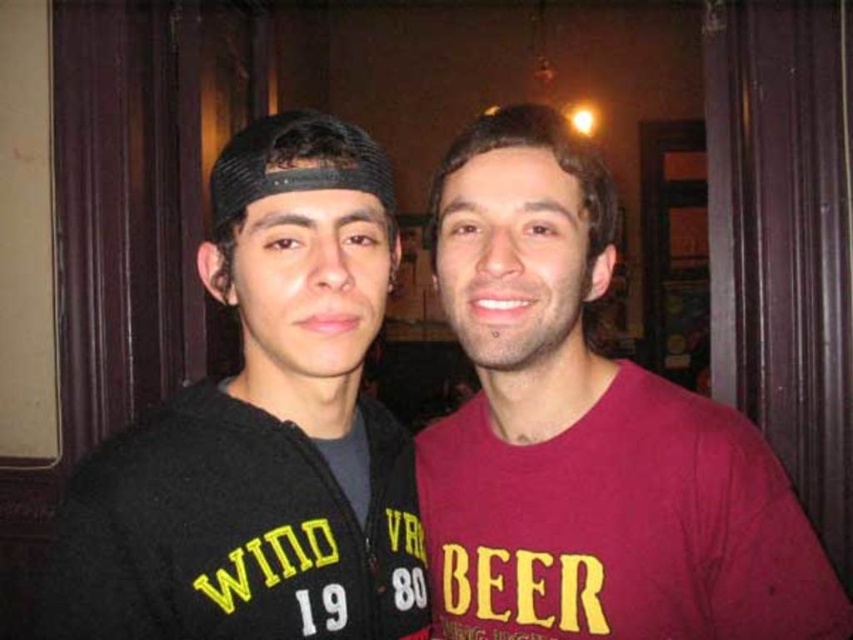
You are a photographer adjusting your camera settings. You want to focus on the black fleece jacket at left and the black knitted cap at center. Which object should you adjust your focus to first to ensure both are in sharp focus?

You should focus on the black fleece jacket at left first because it is closer to the viewer than the black knitted cap at center, allowing the cap to fall within the depth of field when focused on the closer object.